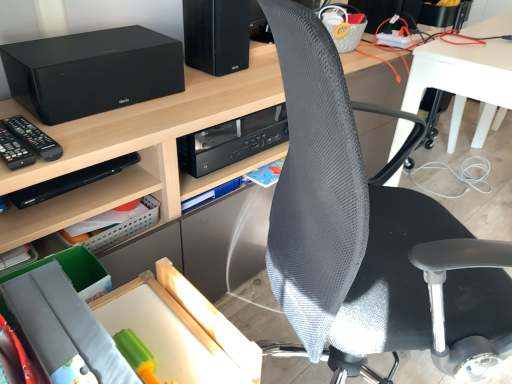
Question: Is black plastic remote control at left positioned far away from black matte speaker at upper left?

Choices:
 (A) no
 (B) yes

Answer: (A)

Question: Is black plastic remote control at left to the right of black matte speaker at upper left from the viewer's perspective?

Choices:
 (A) yes
 (B) no

Answer: (B)

Question: Can you confirm if black plastic remote control at left is smaller than black matte speaker at upper left?

Choices:
 (A) yes
 (B) no

Answer: (A)

Question: Considering the relative sizes of black plastic remote control at left and black matte speaker at upper left in the image provided, is black plastic remote control at left taller than black matte speaker at upper left?

Choices:
 (A) no
 (B) yes

Answer: (A)

Question: Is black plastic remote control at left in front of black matte speaker at upper left?

Choices:
 (A) no
 (B) yes

Answer: (B)

Question: Is black plastic remote control at left positioned with its back to black matte speaker at upper left?

Choices:
 (A) yes
 (B) no

Answer: (B)

Question: Could you tell me if black plastic shelf at lower left is turned towards black plastic remote control at left?

Choices:
 (A) yes
 (B) no

Answer: (B)

Question: Is black plastic shelf at lower left at the left side of black plastic remote control at left?

Choices:
 (A) yes
 (B) no

Answer: (B)

Question: Is black plastic shelf at lower left behind black plastic remote control at left?

Choices:
 (A) no
 (B) yes

Answer: (B)

Question: From a real-world perspective, is black plastic shelf at lower left positioned over black plastic remote control at left based on gravity?

Choices:
 (A) yes
 (B) no

Answer: (B)

Question: From a real-world perspective, is black plastic shelf at lower left positioned under black plastic remote control at left based on gravity?

Choices:
 (A) no
 (B) yes

Answer: (B)

Question: Is black plastic shelf at lower left oriented away from black plastic remote control at left?

Choices:
 (A) yes
 (B) no

Answer: (B)

Question: Is black matte speaker at upper left to the left of black mesh chair at center from the viewer's perspective?

Choices:
 (A) yes
 (B) no

Answer: (A)